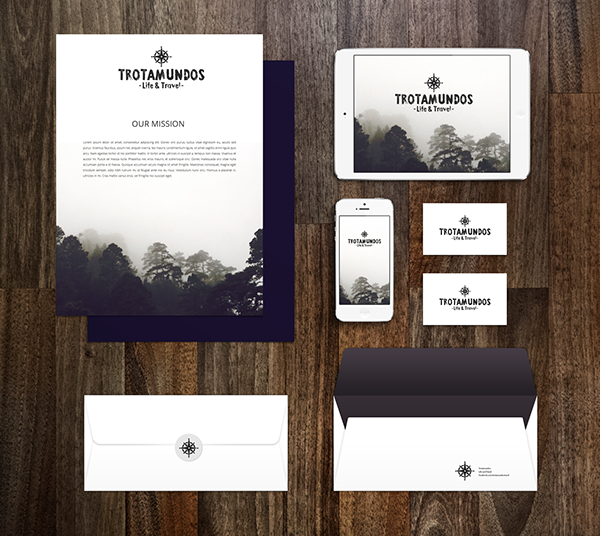
Where is `dark brown flat surface made of planks`? The height and width of the screenshot is (536, 600). dark brown flat surface made of planks is located at coordinates click(548, 210).